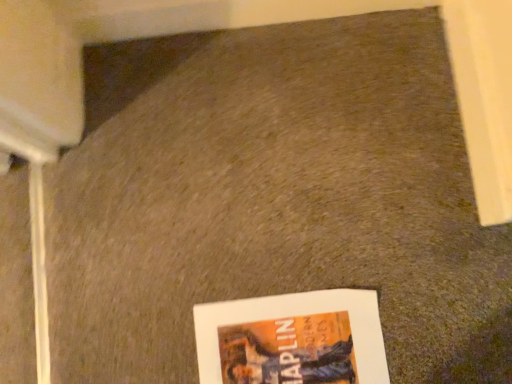
Find the location of a particular element. The height and width of the screenshot is (384, 512). free spot above matte paper picture frame at lower center (from a real-world perspective) is located at coordinates (297, 344).